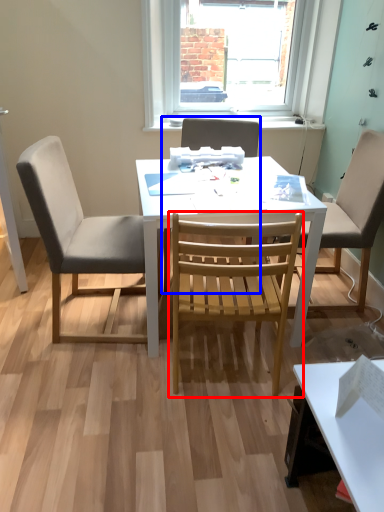
Question: Which object appears farthest to the camera in this image, chair (highlighted by a red box) or chair (highlighted by a blue box)?

Choices:
 (A) chair
 (B) chair

Answer: (B)